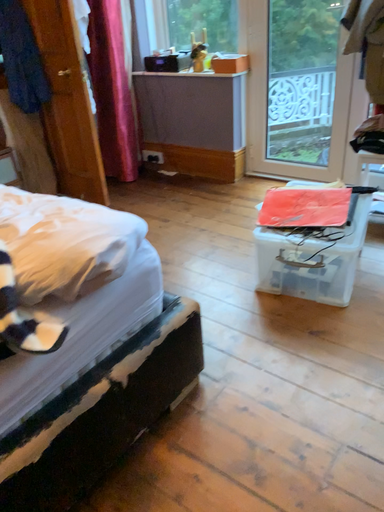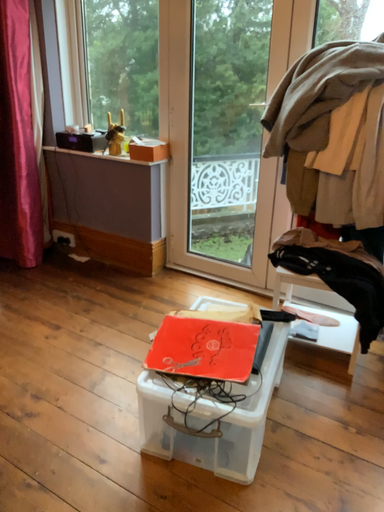
Question: How did the camera likely rotate when shooting the video?

Choices:
 (A) rotated left
 (B) rotated right

Answer: (B)